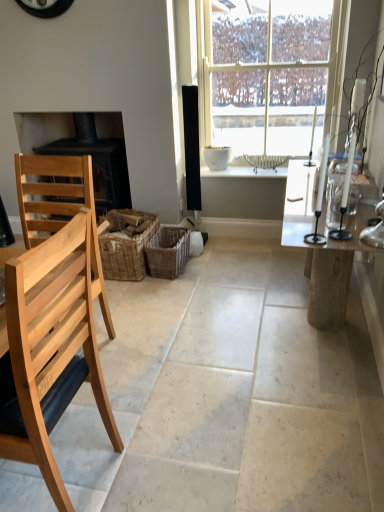
Question: Is the depth of black matte fireplace at left less than that of clear glass table at right?

Choices:
 (A) no
 (B) yes

Answer: (A)

Question: Does black matte fireplace at left have a lesser width compared to clear glass table at right?

Choices:
 (A) no
 (B) yes

Answer: (B)

Question: Is black matte fireplace at left directly adjacent to clear glass table at right?

Choices:
 (A) no
 (B) yes

Answer: (A)

Question: Is black matte fireplace at left located outside clear glass table at right?

Choices:
 (A) no
 (B) yes

Answer: (B)

Question: Is black matte fireplace at left taller than clear glass table at right?

Choices:
 (A) no
 (B) yes

Answer: (B)

Question: From the image's perspective, is black matte fireplace at left beneath clear glass table at right?

Choices:
 (A) no
 (B) yes

Answer: (A)

Question: Is white glass window at center completely or partially outside of white wicker basket at center?

Choices:
 (A) yes
 (B) no

Answer: (A)

Question: Does white glass window at center have a greater width compared to white wicker basket at center?

Choices:
 (A) yes
 (B) no

Answer: (B)

Question: Does white glass window at center have a larger size compared to white wicker basket at center?

Choices:
 (A) no
 (B) yes

Answer: (B)

Question: Is white glass window at center closer to camera compared to white wicker basket at center?

Choices:
 (A) yes
 (B) no

Answer: (A)

Question: Considering the relative sizes of white glass window at center and white wicker basket at center in the image provided, is white glass window at center taller than white wicker basket at center?

Choices:
 (A) yes
 (B) no

Answer: (A)

Question: Is white wicker basket at center surrounded by white glass window at center?

Choices:
 (A) no
 (B) yes

Answer: (A)

Question: Are clear glass table at right and woven brown basket at center, the 1th crate positioned from the right, far apart?

Choices:
 (A) yes
 (B) no

Answer: (A)